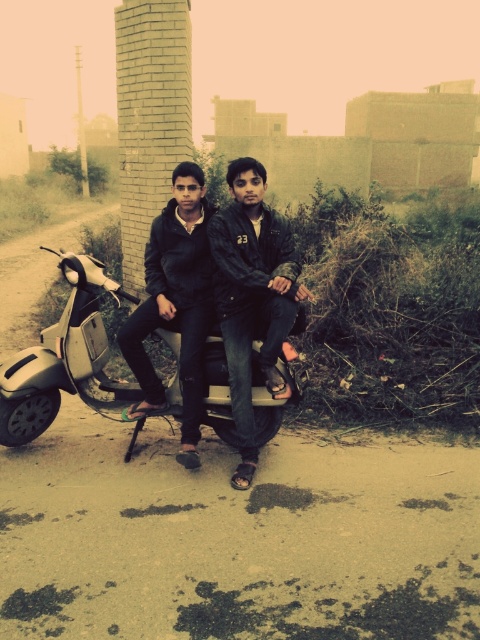
You are a photographer standing on the dirt road. You want to take a picture of the dark blue jeans at center and the metallic silver scooter at center. Which object should you focus on first if you want to capture both in the frame without moving the camera?

The dark blue jeans at center is bigger than the metallic silver scooter at center, so you should focus on the dark blue jeans at center first to ensure it is in focus before the smaller scooter.

You are a photographer standing in front of the dark blue jeans at center and the metallic silver scooter at center. You want to take a photo that includes both objects in the frame. Which object should you position closer to the camera to ensure both are fully visible?

The dark blue jeans at center is much taller than the metallic silver scooter at center. To ensure both are fully visible in the photo, position the dark blue jeans at center closer to the camera. This way, the taller object will occupy less height in the frame, allowing the shorter scooter to be captured without cropping.

You are a photographer trying to capture a photo of the two people on the scooter. You notice two specific points in the scene marked as point 1 at coordinates point (160, 248) and point 2 at coordinates point (14, 413). Which point is closer to the camera so that you can focus on it first?

Point (160, 248) is further to the viewer than point (14, 413). Therefore, point (14, 413) is closer to the camera and should be focused on first.